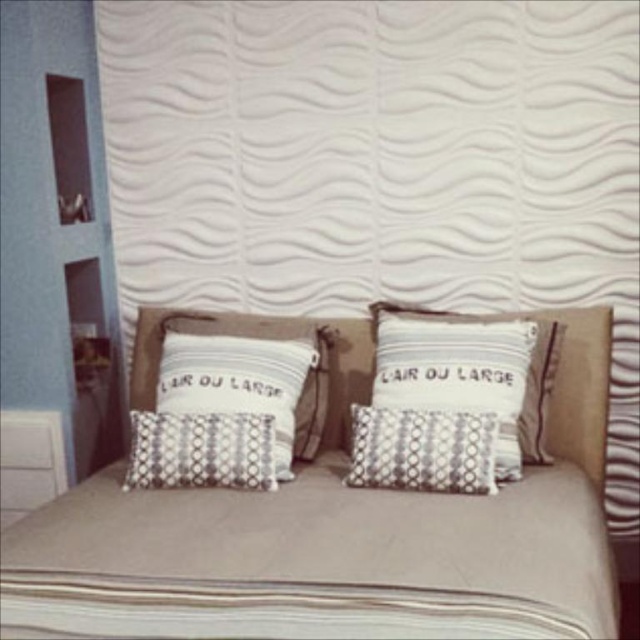
Which is above, white textured pillow at center or patterned fabric pillow at center?

white textured pillow at center

Does white textured pillow at center have a larger size compared to patterned fabric pillow at center?

Indeed, white textured pillow at center has a larger size compared to patterned fabric pillow at center.

At what (x,y) coordinates should I click in order to perform the action: click on white textured pillow at center. Please return your answer as a coordinate pair (x, y). Image resolution: width=640 pixels, height=640 pixels. Looking at the image, I should click on (456, 372).

Can you confirm if beige fabric bed at center is positioned to the right of white textured pillow at center?

Incorrect, beige fabric bed at center is not on the right side of white textured pillow at center.

Does beige fabric bed at center have a lesser width compared to white textured pillow at center?

No.

The width and height of the screenshot is (640, 640). Find the location of `beige fabric bed at center`. beige fabric bed at center is located at coordinates (339, 538).

Which of these two, silver metallic pillow at center or patterned fabric pillow at center, stands taller?

silver metallic pillow at center is taller.

Who is more forward, (429, 456) or (243, 433)?

Point (429, 456) is more forward.

The width and height of the screenshot is (640, 640). What are the coordinates of `silver metallic pillow at center` in the screenshot? It's located at (420, 449).